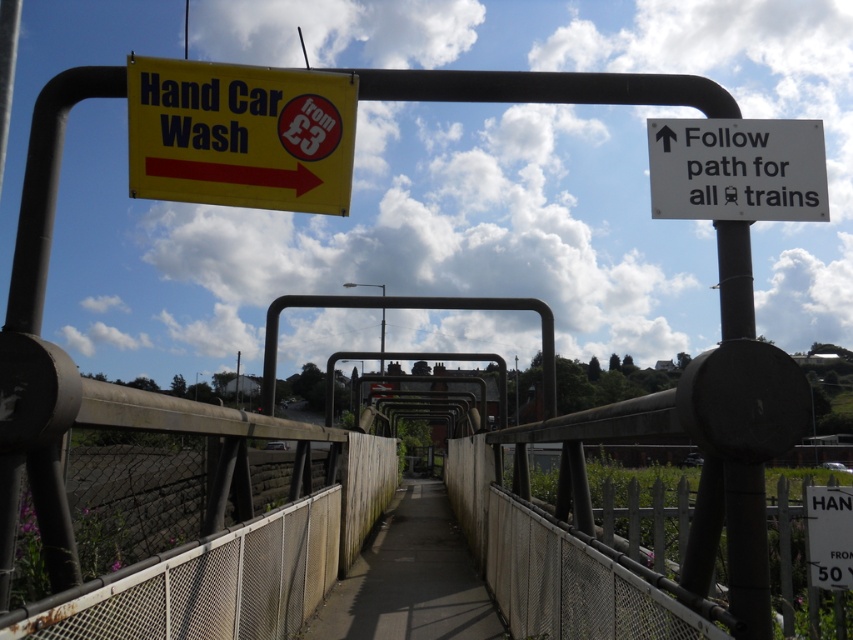
Can you confirm if concrete sidewalk at center is smaller than black metal pole at center?

No.

Is concrete sidewalk at center positioned at the back of black metal pole at center?

Yes.

You are a GUI agent. You are given a task and a screenshot of the screen. Output one action in this format:
    pyautogui.click(x=<x>, y=<y>)
    Task: Click on the concrete sidewalk at center
    
    Given the screenshot: What is the action you would take?
    pyautogui.click(x=410, y=579)

Is yellow plastic sign at upper left to the left of white plastic sign at upper right from the viewer's perspective?

Correct, you'll find yellow plastic sign at upper left to the left of white plastic sign at upper right.

Can you confirm if yellow plastic sign at upper left is positioned below white plastic sign at upper right?

Actually, yellow plastic sign at upper left is above white plastic sign at upper right.

I want to click on yellow plastic sign at upper left, so click(x=239, y=134).

Is point (212, 192) in front of point (465, 570)?

Yes, it is.

What do you see at coordinates (239, 134) in the screenshot? I see `yellow plastic sign at upper left` at bounding box center [239, 134].

Which is behind, point (267, 150) or point (318, 611)?

The point (318, 611) is more distant.

Find the location of a particular element. The height and width of the screenshot is (640, 853). yellow plastic sign at upper left is located at coordinates (239, 134).